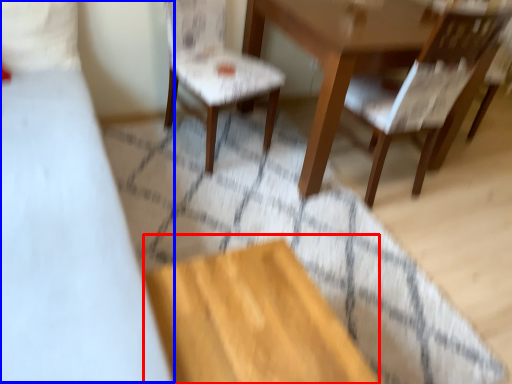
Question: Which object is closer to the camera taking this photo, plywood (highlighted by a red box) or bed (highlighted by a blue box)?

Choices:
 (A) plywood
 (B) bed

Answer: (B)